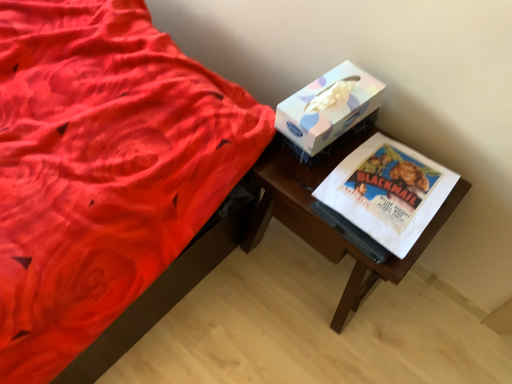
You are a GUI agent. You are given a task and a screenshot of the screen. Output one action in this format:
    pyautogui.click(x=<x>, y=<y>)
    Task: Click on the free point above pastel paper tissue box at upper right (from a real-world perspective)
    This screenshot has width=512, height=384.
    Given the screenshot: What is the action you would take?
    pyautogui.click(x=336, y=91)